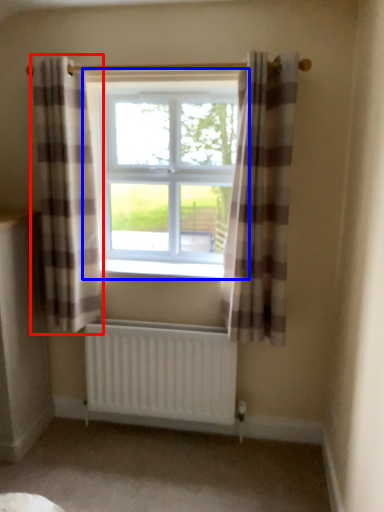
Question: Which object appears closest to the camera in this image, curtain (highlighted by a red box) or window (highlighted by a blue box)?

Choices:
 (A) curtain
 (B) window

Answer: (A)